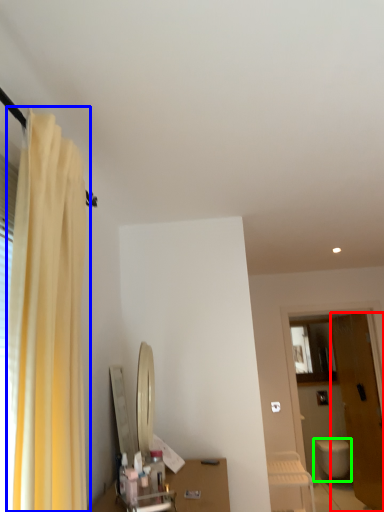
Question: Considering the real-world distances, which object is closest to door (highlighted by a red box)? curtain (highlighted by a blue box) or toilet (highlighted by a green box).

Choices:
 (A) curtain
 (B) toilet

Answer: (B)